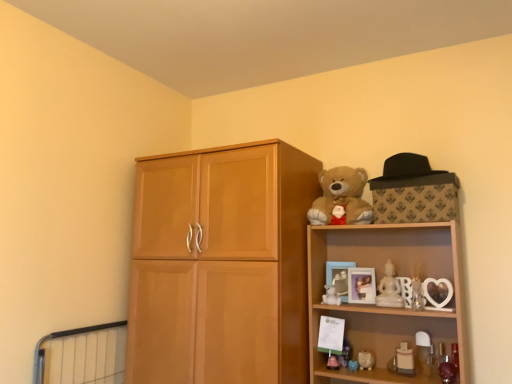
The width and height of the screenshot is (512, 384). What are the coordinates of `matte white picture frame at upper right, acting as the 1th picture frame starting from the left` in the screenshot? It's located at (339, 277).

Measure the distance between point (372, 359) and camera.

Point (372, 359) is 6.29 feet from camera.

This screenshot has width=512, height=384. Describe the element at coordinates (366, 360) in the screenshot. I see `white glossy piggy bank at lower right, the second toy viewed from the left` at that location.

What is the approximate width of light brown wood cupboard at center?

light brown wood cupboard at center is 22.06 inches wide.

Identify the location of soft plush teddy bear at upper right. (341, 198).

Image resolution: width=512 pixels, height=384 pixels. What are the coordinates of `black felt hat at upper right` in the screenshot? It's located at (410, 173).

Where is `matte white picture frame at upper right, acting as the 1th picture frame starting from the left`? The image size is (512, 384). matte white picture frame at upper right, acting as the 1th picture frame starting from the left is located at coordinates (339, 277).

From the image's perspective, which one is positioned lower, light brown wood cupboard at center or white glossy candle at lower right, which is the 4th toy from left to right?

From the image's view, white glossy candle at lower right, which is the 4th toy from left to right, is below.

Does light brown wood cupboard at center have a larger size compared to white glossy candle at lower right, which is the 4th toy from left to right?

Correct, light brown wood cupboard at center is larger in size than white glossy candle at lower right, which is the 4th toy from left to right.

Relative to white glossy candle at lower right, which is the 4th toy from left to right, is light brown wood cupboard at center in front or behind?

light brown wood cupboard at center is positioned closer to the viewer than white glossy candle at lower right, which is the 4th toy from left to right.

Starting from the light brown wood cupboard at center, which toy is the 4th one to the right? Please provide its 2D coordinates.

[(404, 360)]

Is there a large distance between wooden picture frame at upper right, which appears as the 1th picture frame when viewed from the right, and matte white picture frame at upper right, arranged as the 2th picture frame when viewed from the right?

wooden picture frame at upper right, which appears as the 1th picture frame when viewed from the right, is near matte white picture frame at upper right, arranged as the 2th picture frame when viewed from the right, not far away.

Is wooden picture frame at upper right, which appears as the 1th picture frame when viewed from the right, oriented away from matte white picture frame at upper right, acting as the 1th picture frame starting from the left?

No, wooden picture frame at upper right, which appears as the 1th picture frame when viewed from the right, is not facing away from matte white picture frame at upper right, acting as the 1th picture frame starting from the left.

Can you tell me how much wooden picture frame at upper right, arranged as the 2th picture frame when viewed from the left, and matte white picture frame at upper right, acting as the 1th picture frame starting from the left, differ in facing direction?

They differ by 1.83 degrees in their facing directions.

Is light brown wood cupboard at center at the back of wooden shelf at upper right?

That's not correct — wooden shelf at upper right is not looking away from light brown wood cupboard at center.

From the picture: Between wooden shelf at upper right and light brown wood cupboard at center, which one has less height?

wooden shelf at upper right is shorter.

Considering the relative sizes of wooden shelf at upper right and light brown wood cupboard at center in the image provided, is wooden shelf at upper right thinner than light brown wood cupboard at center?

Correct, the width of wooden shelf at upper right is less than that of light brown wood cupboard at center.

Considering the points (310, 226) and (227, 179), which point is behind, point (310, 226) or point (227, 179)?

Positioned behind is point (310, 226).

Is wooden picture frame at upper right, arranged as the 2th picture frame when viewed from the left, thinner than light brown wood cupboard at center?

Correct, the width of wooden picture frame at upper right, arranged as the 2th picture frame when viewed from the left, is less than that of light brown wood cupboard at center.

In the image, is wooden picture frame at upper right, which appears as the 1th picture frame when viewed from the right, positioned in front of or behind light brown wood cupboard at center?

In the image, wooden picture frame at upper right, which appears as the 1th picture frame when viewed from the right, appears behind light brown wood cupboard at center.

Between wooden picture frame at upper right, arranged as the 2th picture frame when viewed from the left, and light brown wood cupboard at center, which one appears on the left side from the viewer's perspective?

From the viewer's perspective, light brown wood cupboard at center appears more on the left side.

From the picture: Is the surface of wooden picture frame at upper right, arranged as the 2th picture frame when viewed from the left, in direct contact with light brown wood cupboard at center?

No, wooden picture frame at upper right, arranged as the 2th picture frame when viewed from the left, is not making contact with light brown wood cupboard at center.

Is white glossy bottle at lower right, acting as the fifth toy starting from the left, closer to camera compared to white glossy piggy bank at lower right, the second toy viewed from the left?

Yes, white glossy bottle at lower right, acting as the fifth toy starting from the left, is closer to the camera.

Is white glossy piggy bank at lower right, the second toy viewed from the left, located within white glossy bottle at lower right, acting as the first toy starting from the right?

That's incorrect, white glossy piggy bank at lower right, the second toy viewed from the left, is not inside white glossy bottle at lower right, acting as the first toy starting from the right.

Are white glossy bottle at lower right, acting as the fifth toy starting from the left, and white glossy piggy bank at lower right, the second toy viewed from the left, making contact?

white glossy bottle at lower right, acting as the fifth toy starting from the left, and white glossy piggy bank at lower right, the second toy viewed from the left, are not in contact.

From their relative heights in the image, would you say white glossy bottle at lower right, acting as the fifth toy starting from the left, is taller or shorter than white glossy piggy bank at lower right, which is the fourth toy in right-to-left order?

Considering their sizes, white glossy bottle at lower right, acting as the fifth toy starting from the left, has more height than white glossy piggy bank at lower right, which is the fourth toy in right-to-left order.

From a real-world perspective, who is located higher, matte white picture frame at upper right, acting as the 1th picture frame starting from the left, or wooden shelf at upper right?

In real-world perspective, matte white picture frame at upper right, acting as the 1th picture frame starting from the left, is above.

Is matte white picture frame at upper right, arranged as the 2th picture frame when viewed from the right, further to the viewer compared to wooden shelf at upper right?

Yes.

Looking at the image, does matte white picture frame at upper right, arranged as the 2th picture frame when viewed from the right, seem bigger or smaller compared to wooden shelf at upper right?

matte white picture frame at upper right, arranged as the 2th picture frame when viewed from the right, is smaller than wooden shelf at upper right.

Which is in front, wooden shelf at upper right or white matte teddy bear at upper right, which is the 5th toy in right-to-left order?

wooden shelf at upper right.

Which of these two, wooden shelf at upper right or white matte teddy bear at upper right, arranged as the first toy when viewed from the left, is bigger?

wooden shelf at upper right.

How different are the orientations of wooden shelf at upper right and white matte teddy bear at upper right, arranged as the first toy when viewed from the left, in degrees?

The angular difference between wooden shelf at upper right and white matte teddy bear at upper right, arranged as the first toy when viewed from the left, is 0.518 degrees.

Can white matte teddy bear at upper right, which is the 5th toy in right-to-left order, be found inside wooden shelf at upper right?

Yes, white matte teddy bear at upper right, which is the 5th toy in right-to-left order, is a part of wooden shelf at upper right.

I want to click on cupboard to the left of white glossy candle at lower right, the 2th toy when ordered from right to left, so click(x=221, y=267).

This screenshot has width=512, height=384. In the image, there is a wooden picture frame at upper right, which appears as the 1th picture frame when viewed from the right. Find the location of `picture frame above it (from the image's perspective)`. picture frame above it (from the image's perspective) is located at coordinates (339, 277).

Estimate the real-world distances between objects in this image. Which object is closer to white glossy piggy bank at lower right, which is the fourth toy in right-to-left order, matte white picture frame at upper right, acting as the 1th picture frame starting from the left, or white matte teddy bear at upper right, which is the 5th toy in right-to-left order?

white matte teddy bear at upper right, which is the 5th toy in right-to-left order, lies closer to white glossy piggy bank at lower right, which is the fourth toy in right-to-left order, than the other object.

Looking at the image, which one is located further to soft plush teddy bear at upper right, white glossy bottle at lower right, acting as the fifth toy starting from the left, or wooden picture frame at upper right, arranged as the 2th picture frame when viewed from the left?

white glossy bottle at lower right, acting as the fifth toy starting from the left.

Which object lies nearer to the anchor point white matte teddy bear at upper right, arranged as the first toy when viewed from the left, white glossy candle at lower right, which is the 4th toy from left to right, or wooden picture frame at upper right, which appears as the 1th picture frame when viewed from the right?

wooden picture frame at upper right, which appears as the 1th picture frame when viewed from the right.

Looking at the image, which one is located closer to white glossy piggy bank at lower right, which is the fourth toy in right-to-left order, white glossy bottle at lower right, acting as the fifth toy starting from the left, or soft plush teddy bear at upper right?

Based on the image, white glossy bottle at lower right, acting as the fifth toy starting from the left, appears to be nearer to white glossy piggy bank at lower right, which is the fourth toy in right-to-left order.

Considering their positions, is soft plush teddy bear at upper right positioned further to white glossy bottle at lower right, acting as the first toy starting from the right, than matte white picture frame at upper right, acting as the 1th picture frame starting from the left?

Among the two, soft plush teddy bear at upper right is located further to white glossy bottle at lower right, acting as the first toy starting from the right.

From the image, which object appears to be farther from white marble statue at upper center, marked as the third toy in a right-to-left arrangement, wooden shelf at upper right or white glossy candle at lower right, the 2th toy when ordered from right to left?

white glossy candle at lower right, the 2th toy when ordered from right to left, lies further to white marble statue at upper center, marked as the third toy in a right-to-left arrangement, than the other object.

From the image, which object appears to be farther from white matte teddy bear at upper right, arranged as the first toy when viewed from the left, white glossy candle at lower right, the 2th toy when ordered from right to left, or matte white picture frame at upper right, acting as the 1th picture frame starting from the left?

white glossy candle at lower right, the 2th toy when ordered from right to left.

Estimate the real-world distances between objects in this image. Which object is further from matte white picture frame at upper right, acting as the 1th picture frame starting from the left, soft plush teddy bear at upper right or white glossy candle at lower right, which is the 4th toy from left to right?

Among the two, white glossy candle at lower right, which is the 4th toy from left to right, is located further to matte white picture frame at upper right, acting as the 1th picture frame starting from the left.

At what (x,y) coordinates should I click in order to perform the action: click on toy between black felt hat at upper right and matte white picture frame at upper right, acting as the 1th picture frame starting from the left, in the vertical direction. Please return your answer as a coordinate pair (x, y). The width and height of the screenshot is (512, 384). Looking at the image, I should click on (389, 289).

At what (x,y) coordinates should I click in order to perform the action: click on teddy bear between light brown wood cupboard at center and wooden picture frame at upper right, arranged as the 2th picture frame when viewed from the left. Please return your answer as a coordinate pair (x, y). The image size is (512, 384). Looking at the image, I should click on (341, 198).

You are a GUI agent. You are given a task and a screenshot of the screen. Output one action in this format:
    pyautogui.click(x=<x>, y=<y>)
    Task: Click on the shelf that lies between white marble statue at upper center, the 3th toy viewed from the left, and white glossy bottle at lower right, acting as the first toy starting from the right, from top to bottom
    The height and width of the screenshot is (384, 512).
    Given the screenshot: What is the action you would take?
    pyautogui.click(x=387, y=307)

Locate an element on the screen. This screenshot has width=512, height=384. cupboard between soft plush teddy bear at upper right and white glossy piggy bank at lower right, the second toy viewed from the left, in the vertical direction is located at coordinates (221, 267).